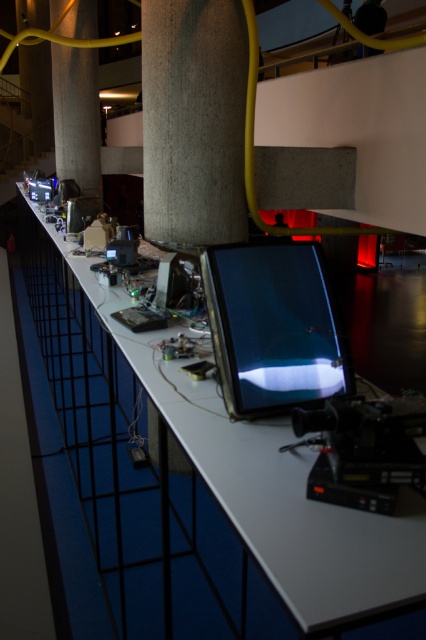
Can you confirm if metallic silver table at center is positioned to the left of concrete column at center?

No, metallic silver table at center is not to the left of concrete column at center.

Measure the distance between point (25, 250) and camera.

Point (25, 250) is 10.84 meters from camera.

I want to click on metallic silver table at center, so click(161, 486).

Does concrete textured pillar at center have a greater width compared to shiny black tablet at center?

Indeed, concrete textured pillar at center has a greater width compared to shiny black tablet at center.

What do you see at coordinates (193, 120) in the screenshot?
I see `concrete textured pillar at center` at bounding box center [193, 120].

Who is more forward, (x=166, y=33) or (x=270, y=250)?

Point (x=270, y=250)

Where is `concrete textured pillar at center`? The height and width of the screenshot is (640, 426). concrete textured pillar at center is located at coordinates (193, 120).

Can you confirm if metallic silver table at center is positioned to the left of concrete textured pillar at center?

Incorrect, metallic silver table at center is not on the left side of concrete textured pillar at center.

Can you confirm if metallic silver table at center is bigger than concrete textured pillar at center?

Actually, metallic silver table at center might be smaller than concrete textured pillar at center.

Is point (89, 461) positioned before point (204, 36)?

No, (89, 461) is behind (204, 36).

Locate an element on the screen. metallic silver table at center is located at coordinates (161, 486).